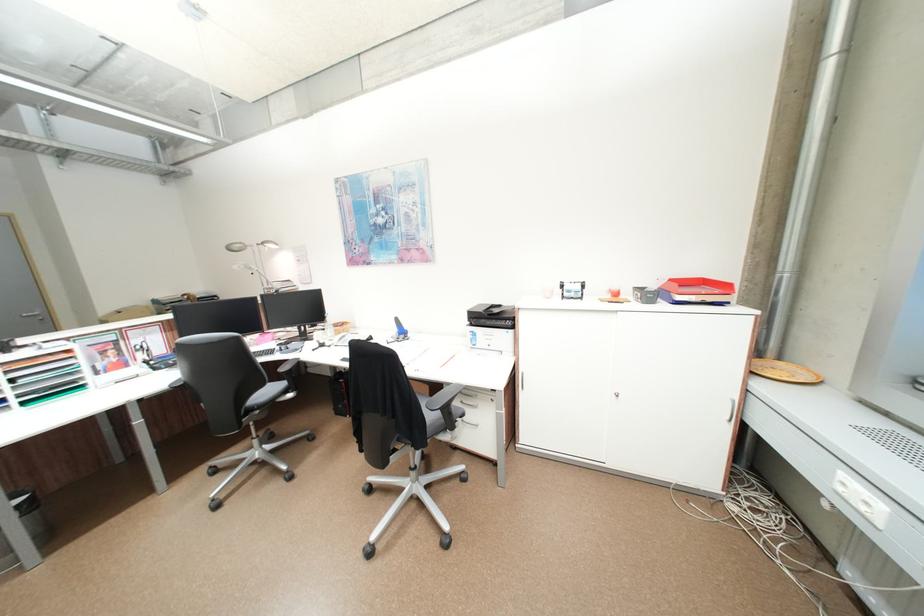
You are a GUI agent. You are given a task and a screenshot of the screen. Output one action in this format:
    pyautogui.click(x=<x>, y=<y>)
    Task: Click on the top drawer handle
    
    Given the screenshot: What is the action you would take?
    pyautogui.click(x=469, y=395)